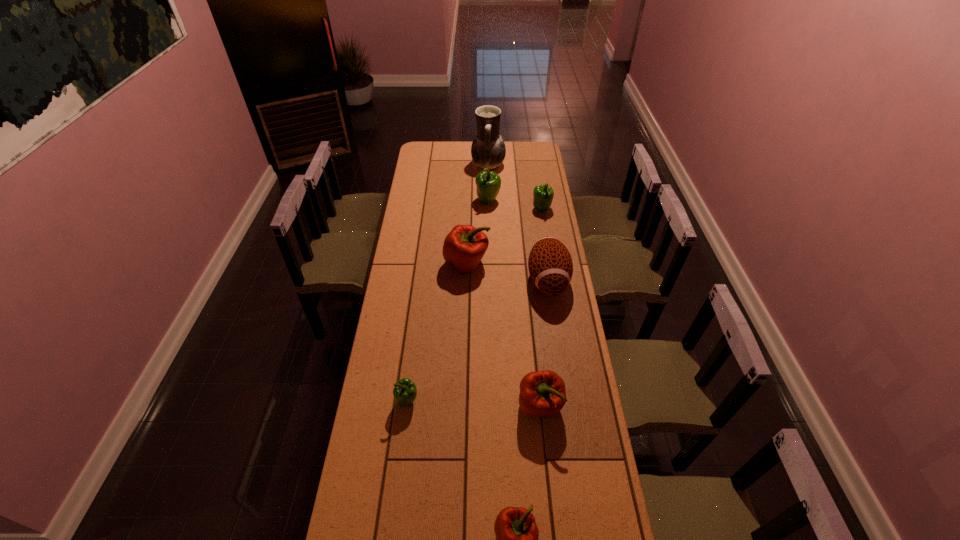
This screenshot has height=540, width=960. Identify the location of vacant area in the image that satisfies the following two spatial constraints: 1. on the front-facing side of the farthest object; 2. on the front side of the leftmost bell pepper. (493, 401).

This screenshot has height=540, width=960. In order to click on vacant space that satisfies the following two spatial constraints: 1. on the back side of the leftmost green bell pepper; 2. on the left side of the third farthest bell pepper in this screenshot , I will do (424, 263).